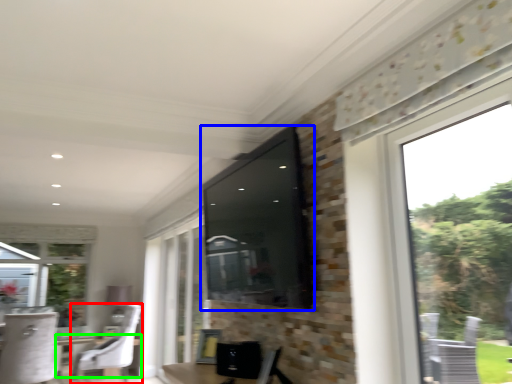
Question: Estimate the real-world distances between objects in this image. Which object is farther from chair (highlighted by a red box), window screen (highlighted by a blue box) or round table (highlighted by a green box)?

Choices:
 (A) window screen
 (B) round table

Answer: (A)